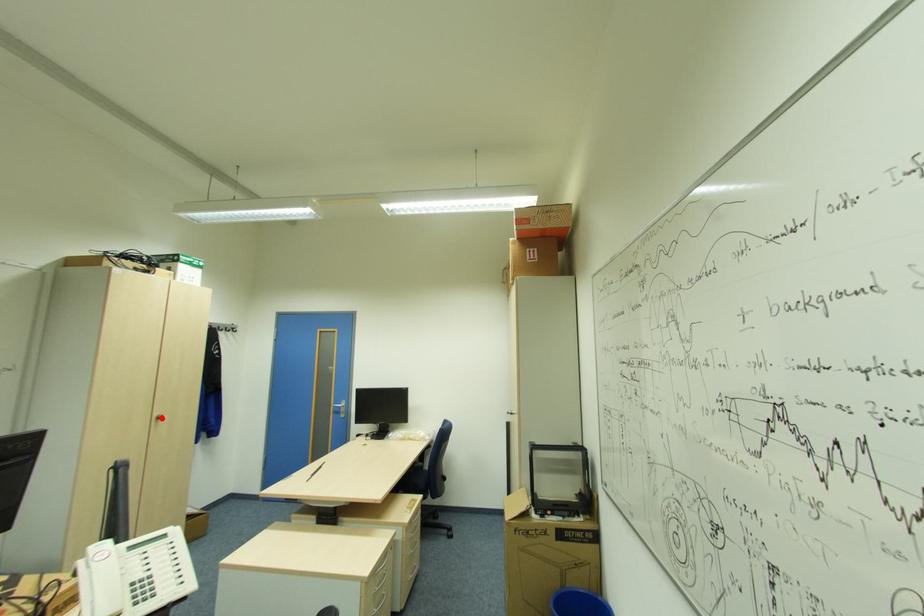
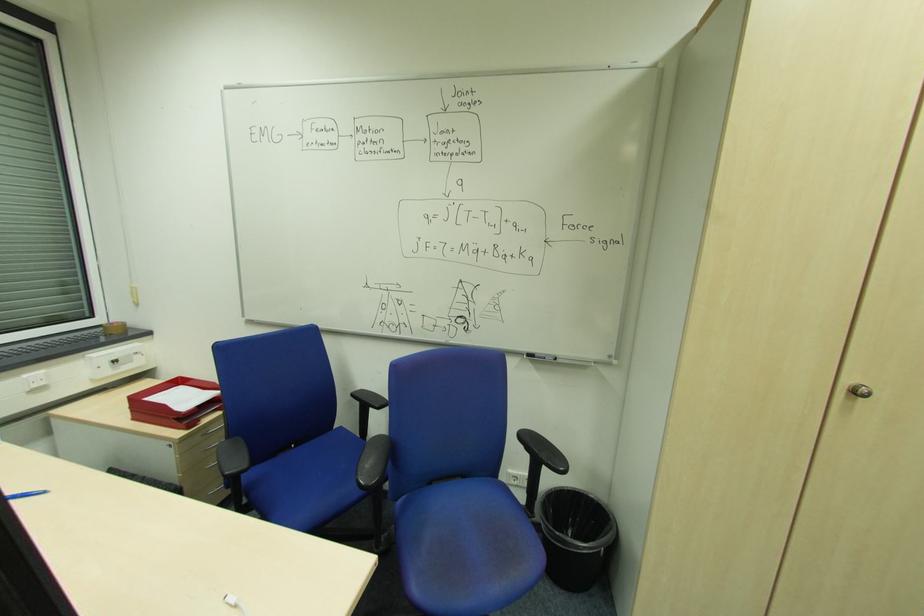
Question: I am providing you with two images of the same scene from different viewpoints. Image1 has a red point marked. In image2, the corresponding 3D location appears at what relative position? Reply with the corresponding letter.

Choices:
 (A) Closer
 (B) Farther

Answer: (A)